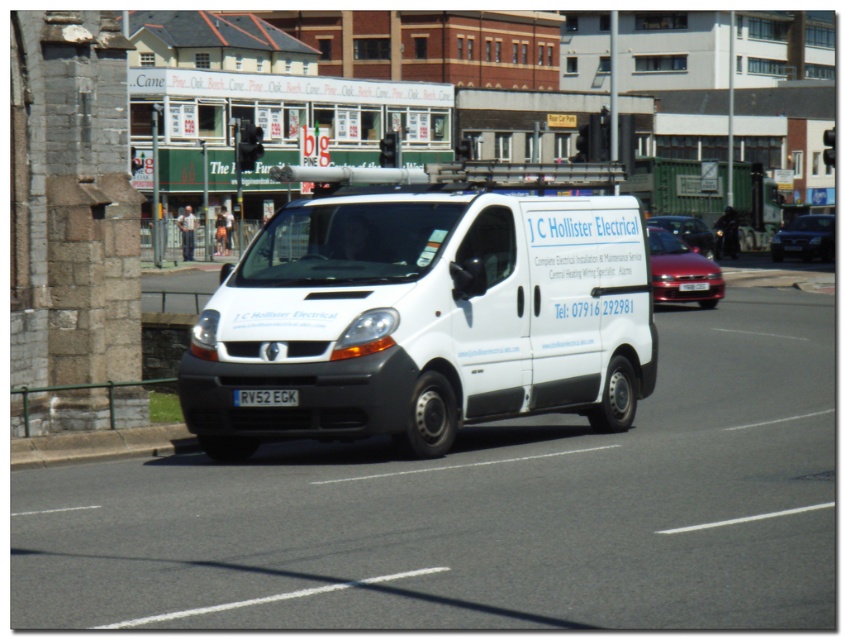
Question: Can you confirm if metallic silver sedan at right is thinner than white plastic license plate at center?

Choices:
 (A) yes
 (B) no

Answer: (B)

Question: Which point is farther to the camera?

Choices:
 (A) shiny red sedan at center
 (B) metallic silver sedan at right

Answer: (B)

Question: Does metallic silver sedan at right appear over white plastic license plate at center?

Choices:
 (A) yes
 (B) no

Answer: (A)

Question: Which point appears farthest from the camera in this image?

Choices:
 (A) (786, 237)
 (B) (702, 284)
 (C) (713, 244)
 (D) (700, 273)

Answer: (A)

Question: Can you confirm if metallic silver sedan at right is thinner than white plastic license plate at center?

Choices:
 (A) yes
 (B) no

Answer: (B)

Question: Which of the following is the farthest from the observer?

Choices:
 (A) metallic silver sedan at right
 (B) white rectangular at center
 (C) white matte van at center

Answer: (A)